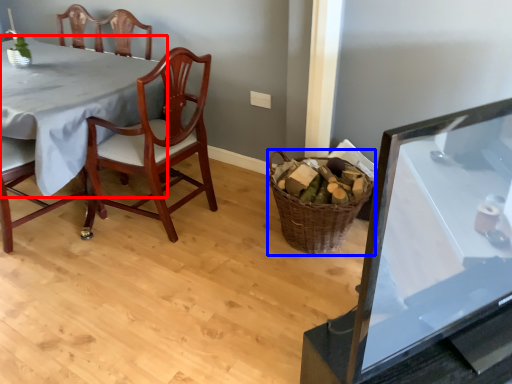
Question: Which of the following is the farthest to the observer, table (highlighted by a red box) or basket (highlighted by a blue box)?

Choices:
 (A) table
 (B) basket

Answer: (A)